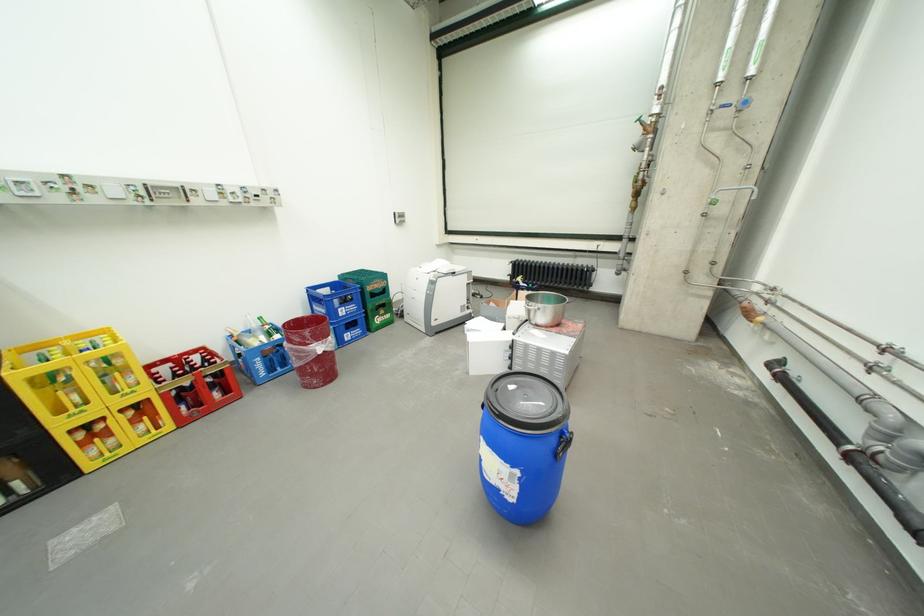
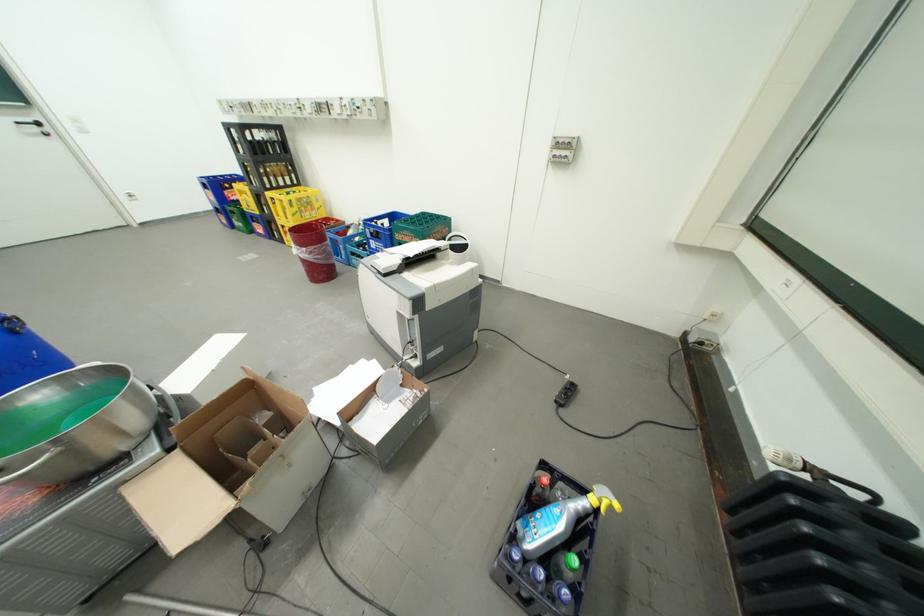
Where in the second image is the point corresponding to the point at 349,310 from the first image?

(381, 241)